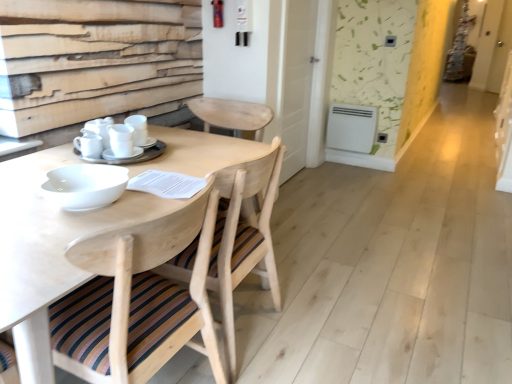
This screenshot has height=384, width=512. I want to click on vacant point to the right of white matte cups at center, placed as the 1th tableware when sorted from right to left, so click(x=180, y=148).